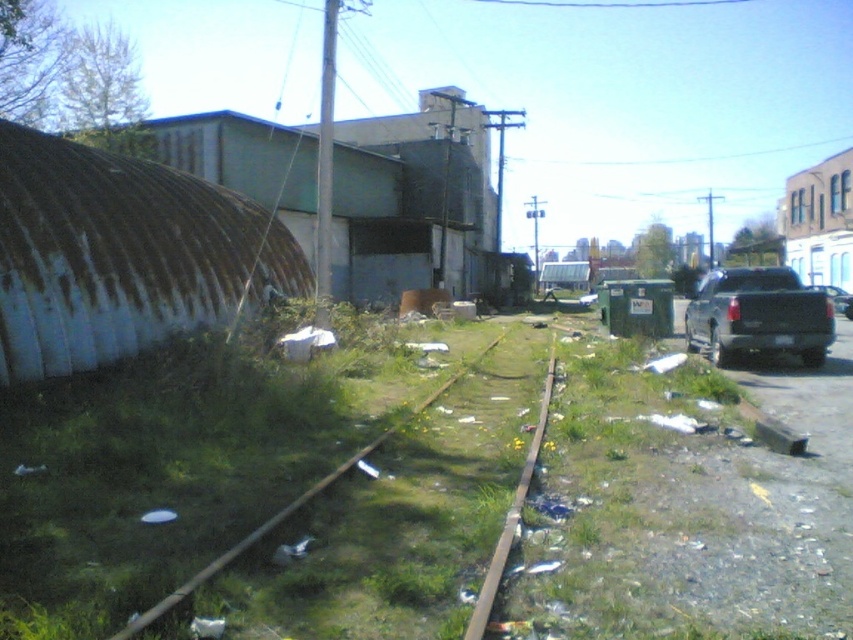
Can you confirm if green grass train track at center is taller than metallic gray truck at right?

Incorrect, green grass train track at center's height is not larger of metallic gray truck at right's.

Looking at this image, is the position of green grass train track at center less distant than that of metallic gray truck at right?

Yes, it is in front of metallic gray truck at right.

Is point (273, 516) behind point (846, 312)?

No, (273, 516) is closer to viewer.

You are a GUI agent. You are given a task and a screenshot of the screen. Output one action in this format:
    pyautogui.click(x=<x>, y=<y>)
    Task: Click on the green grass train track at center
    The image size is (853, 640).
    Given the screenshot: What is the action you would take?
    pyautogui.click(x=289, y=506)

Can you confirm if black matte truck at right is wider than green grassy train track at center?

Yes, black matte truck at right is wider than green grassy train track at center.

Does point (828, 342) come farther from viewer compared to point (468, 636)?

Yes, it is behind point (468, 636).

Is point (717, 296) positioned after point (527, 476)?

That is True.

This screenshot has height=640, width=853. Find the location of `black matte truck at right`. black matte truck at right is located at coordinates (757, 316).

Consider the image. Between black matte truck at right and green grass train track at center, which one is positioned higher?

black matte truck at right is above.

Which is behind, point (695, 291) or point (235, 547)?

Positioned behind is point (695, 291).

This screenshot has width=853, height=640. In order to click on black matte truck at right in this screenshot , I will do `click(757, 316)`.